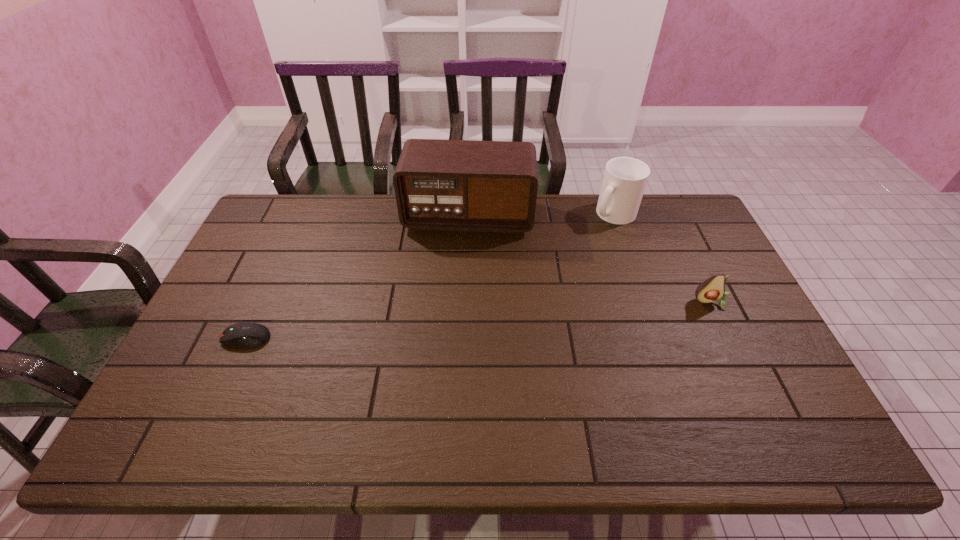
At what (x,y) coordinates should I click in order to perform the action: click on vacant space on the desktop that is between the nearest object and the rightmost object and is positioned on the handle side of the third object from left to right. Please return your answer as a coordinate pair (x, y). Image resolution: width=960 pixels, height=540 pixels. Looking at the image, I should click on (536, 315).

Locate an element on the screen. Image resolution: width=960 pixels, height=540 pixels. free space on the desktop that is between the leftmost object and the rightmost object and is positioned on the front-facing side of the radio receiver is located at coordinates (457, 321).